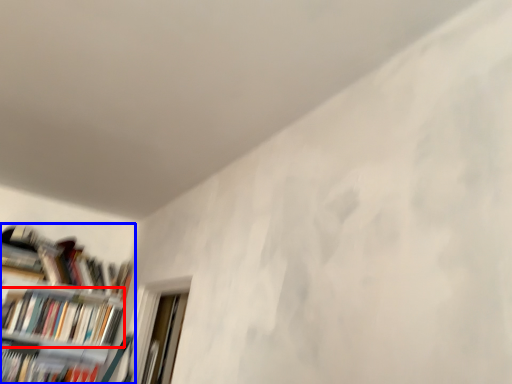
Question: Which of the following is the farthest to the observer, book (highlighted by a red box) or bookcase (highlighted by a blue box)?

Choices:
 (A) book
 (B) bookcase

Answer: (A)